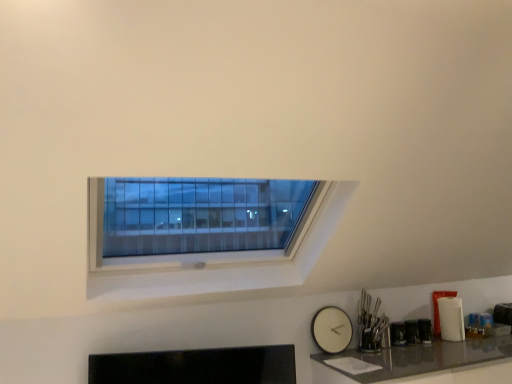
Where is `vacant space to the right of white matte clock at lower right`? The image size is (512, 384). vacant space to the right of white matte clock at lower right is located at coordinates (360, 357).